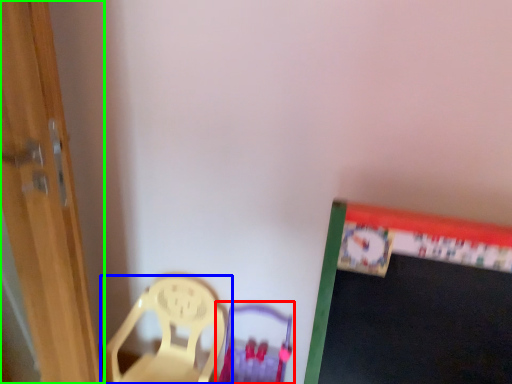
Question: Which object is the closest to the armchair (highlighted by a red box)? Choose among these: chair (highlighted by a blue box) or door (highlighted by a green box).

Choices:
 (A) chair
 (B) door

Answer: (A)